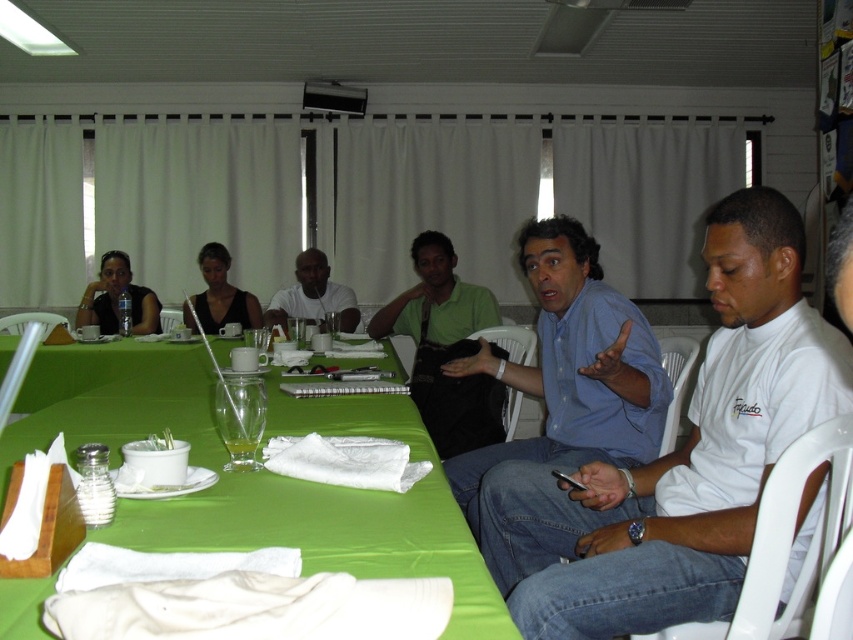
You are planning to place a 1.2 meter wide decorative item on the green fabric table at center. Considering the table and the matte black shirt at upper left, can the table accommodate the item without exceeding its width?

The green fabric table at center is wider than the matte black shirt at upper left. Since the table is wider, it can accommodate the 1.2 meter wide decorative item.

You are standing in the room and want to move from the point at coordinates (225, 442) to the point at coordinates (215, 292). Which direction should you move to get closer to your destination?

Since point (225, 442) is closer to the viewer than point (215, 292), you should move backward to reach the destination.

You are sitting at the long table with a bright green tablecloth and want to pass a note to the person wearing the blue shirt at center. Since you are seated at the matte black shirt at upper left, can you directly hand the note to them without getting up?

The blue shirt at center is below the matte black shirt at upper left, so you can directly hand the note to them without needing to get up as they are positioned lower on the table.